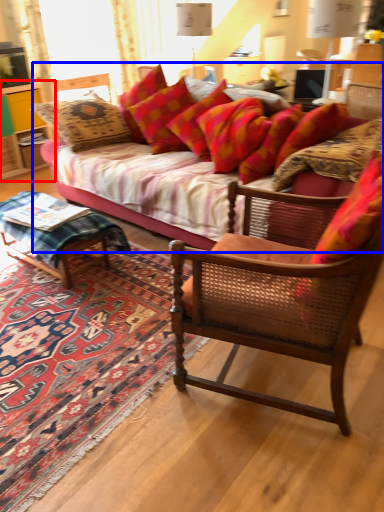
Question: Among these objects, which one is farthest to the camera, cabinetry (highlighted by a red box) or studio couch (highlighted by a blue box)?

Choices:
 (A) cabinetry
 (B) studio couch

Answer: (A)